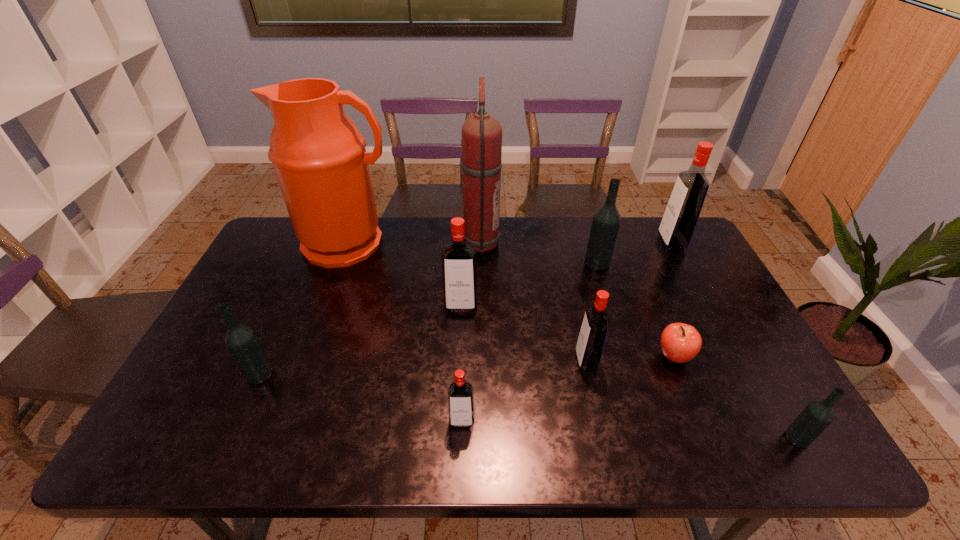
What are the coordinates of `free point at the left edge` in the screenshot? It's located at (268, 301).

You are a GUI agent. You are given a task and a screenshot of the screen. Output one action in this format:
    pyautogui.click(x=<x>, y=<y>)
    Task: Click on the vacant position at the right edge of the desktop
    Image resolution: width=960 pixels, height=540 pixels.
    Given the screenshot: What is the action you would take?
    pyautogui.click(x=656, y=262)

Identify the location of free space at the near right corner of the desktop. (806, 451).

The width and height of the screenshot is (960, 540). I want to click on free space between the smallest black vodka and the third smallest red vodka, so click(x=629, y=372).

Locate an element on the screen. This screenshot has height=540, width=960. free spot between the fire extinguisher and the smallest black vodka is located at coordinates (637, 341).

This screenshot has height=540, width=960. In order to click on free space that is in between the second nearest black vodka and the fifth farthest object in this screenshot , I will do `click(360, 340)`.

Where is `vacant space in between the shortest object and the nearest red vodka`? The image size is (960, 540). vacant space in between the shortest object and the nearest red vodka is located at coordinates (568, 388).

At what (x,y) coordinates should I click in order to perform the action: click on object that is the fourth closest to the pink apple. Please return your answer as a coordinate pair (x, y). This screenshot has width=960, height=540. Looking at the image, I should click on (682, 212).

Identify which object is located as the sixth nearest to the red fire extinguisher. Please provide its 2D coordinates. Your answer should be formatted as a tuple, i.e. [(x, y)], where the tuple contains the x and y coordinates of a point satisfying the conditions above.

[(461, 411)]

Point out which vodka is positioned as the nearest to the pink apple. Please provide its 2D coordinates. Your answer should be formatted as a tuple, i.e. [(x, y)], where the tuple contains the x and y coordinates of a point satisfying the conditions above.

[(589, 349)]